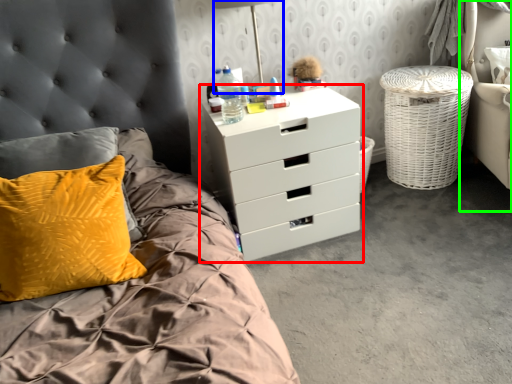
Question: Based on their relative distances, which object is farther from chest of drawers (highlighted by a red box)? Choose from bedside lamp (highlighted by a blue box) and armchair (highlighted by a green box).

Choices:
 (A) bedside lamp
 (B) armchair

Answer: (B)